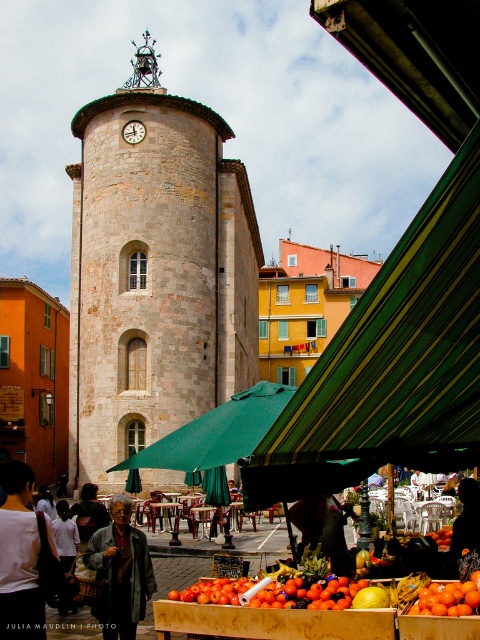
You are standing at the base of the tower and want to reach the fruit stand under the green striped awning at center while avoiding the dark gray jacket at center. Given that the distance between them is 8.23 meters, can you walk straight towards the awning without passing near the jacket?

The green striped awning at center is 8.23 meters away from the dark gray jacket at center. Since they are both at the center, you can walk straight towards the awning without passing near the jacket as they are positioned at the same central location.

You are standing at the point marked as point [392,362] in the image. What object is directly beneath you?

The green striped awning at center is directly beneath you at point [392,362].